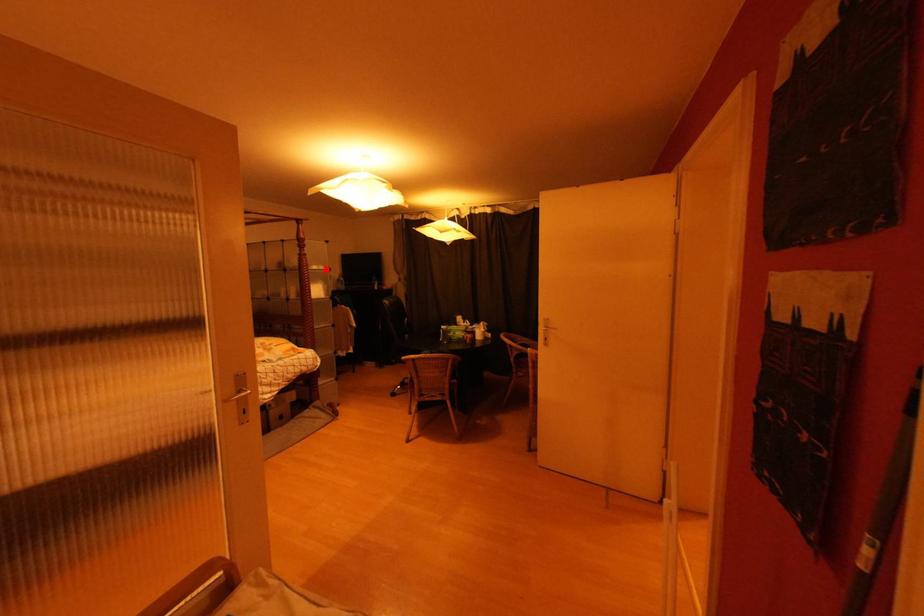
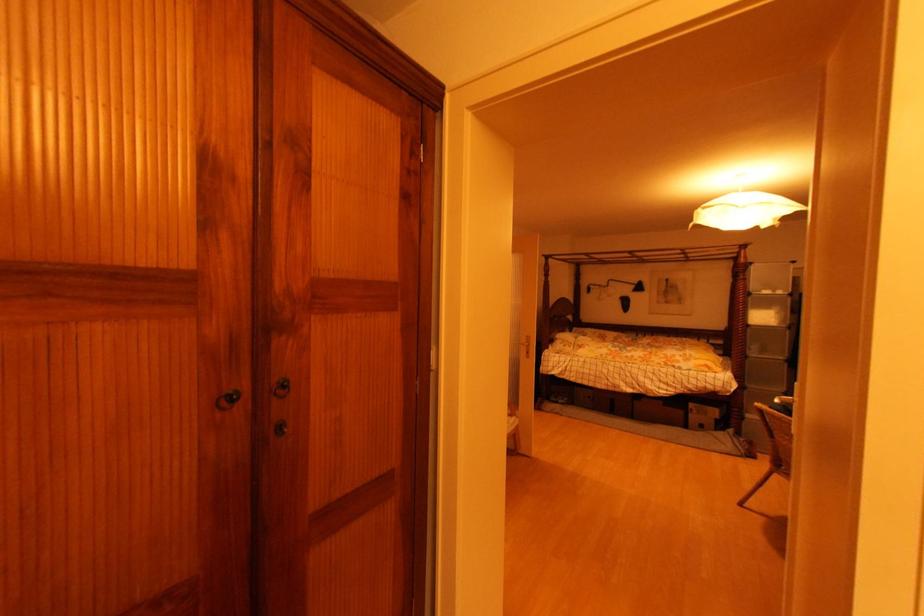
Where in the second image is the point corresponding to the highlighted location from the first image?

(784, 294)